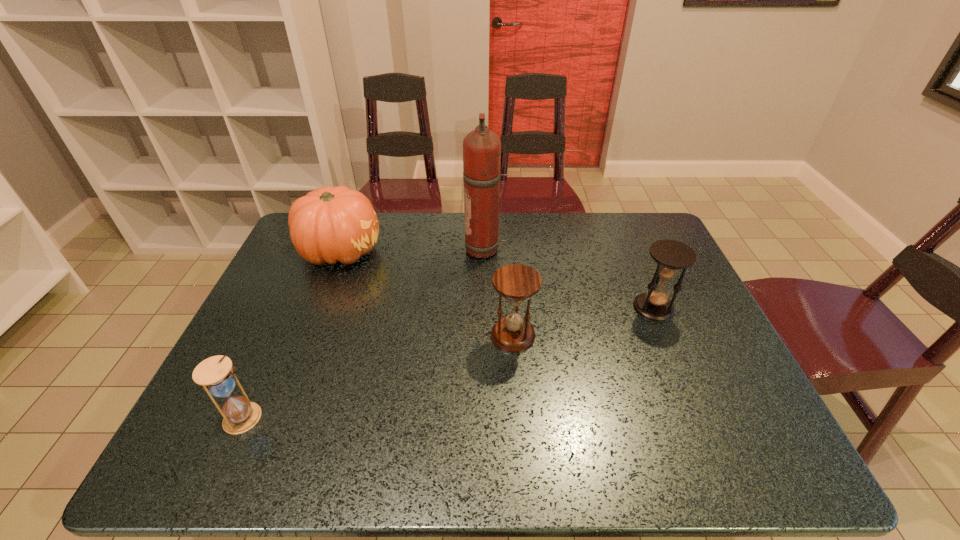
At what (x,y) coordinates should I click in order to perform the action: click on free region that satisfies the following two spatial constraints: 1. on the carved face of the pumpkin; 2. on the back side of the rightmost object. Please return your answer as a coordinate pair (x, y). Looking at the image, I should click on (319, 308).

What are the coordinates of `vacant area in the image that satisfies the following two spatial constraints: 1. on the carved face of the second hourglass from left to right; 2. on the right side of the pumpkin` in the screenshot? It's located at (308, 336).

Locate an element on the screen. This screenshot has width=960, height=540. vacant area in the image that satisfies the following two spatial constraints: 1. on the side of the rightmost object with the label and nozzle; 2. on the right side of the fire extinguisher is located at coordinates (486, 308).

Where is `free region that satisfies the following two spatial constraints: 1. on the carved face of the pumpkin; 2. on the back side of the rightmost hourglass`? free region that satisfies the following two spatial constraints: 1. on the carved face of the pumpkin; 2. on the back side of the rightmost hourglass is located at coordinates (319, 308).

Locate an element on the screen. free spot that satisfies the following two spatial constraints: 1. on the side of the tallest object with the label and nozzle; 2. on the left side of the second hourglass from left to right is located at coordinates (487, 336).

Locate an element on the screen. This screenshot has height=540, width=960. blank area in the image that satisfies the following two spatial constraints: 1. on the side of the rightmost hourglass with the label and nozzle; 2. on the right side of the tallest object is located at coordinates (486, 308).

At what (x,y) coordinates should I click in order to perform the action: click on blank space that satisfies the following two spatial constraints: 1. on the side of the tallest object with the label and nozzle; 2. on the right side of the second hourglass from left to right. Please return your answer as a coordinate pair (x, y). The image size is (960, 540). Looking at the image, I should click on (487, 336).